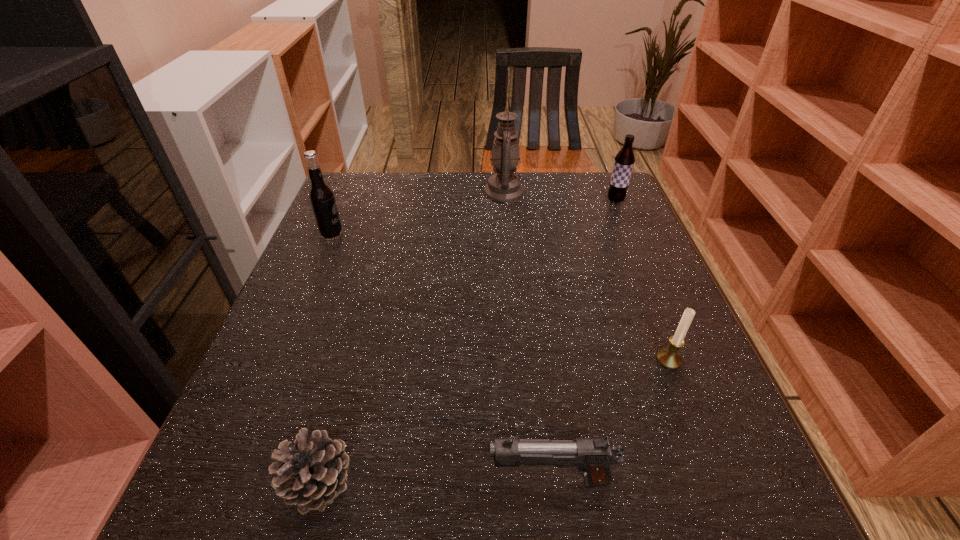
In order to click on free space located on the front of the shorter root beer in this screenshot , I will do `click(644, 268)`.

The width and height of the screenshot is (960, 540). What are the coordinates of `free space located on the front of the candle holder` in the screenshot? It's located at (704, 450).

Find the location of a particular element. free space located 0.060m in the direction the gun is aimed is located at coordinates (448, 480).

At what (x,y) coordinates should I click in order to perform the action: click on free spot located 0.220m in the direction the gun is aimed. Please return your answer as a coordinate pair (x, y). The width and height of the screenshot is (960, 540). Looking at the image, I should click on (340, 480).

Identify the location of blank space located 0.250m in the direction the gun is aimed. (320, 480).

Where is `vacant space located on the left of the pinecone`? This screenshot has height=540, width=960. vacant space located on the left of the pinecone is located at coordinates (244, 482).

You are a GUI agent. You are given a task and a screenshot of the screen. Output one action in this format:
    pyautogui.click(x=<x>, y=<y>)
    Task: Click on the oil lamp positioned at the far edge
    The height and width of the screenshot is (540, 960).
    Given the screenshot: What is the action you would take?
    pyautogui.click(x=504, y=186)

Find the location of a particular element. This screenshot has height=540, width=960. root beer at the far edge is located at coordinates (624, 161).

You are a GUI agent. You are given a task and a screenshot of the screen. Output one action in this format:
    pyautogui.click(x=<x>, y=<y>)
    Task: Click on the gun that is positioned at the near edge
    The image size is (960, 540).
    Given the screenshot: What is the action you would take?
    pyautogui.click(x=593, y=456)

Locate an element on the screen. Image resolution: width=960 pixels, height=540 pixels. pinecone that is at the near edge is located at coordinates (311, 473).